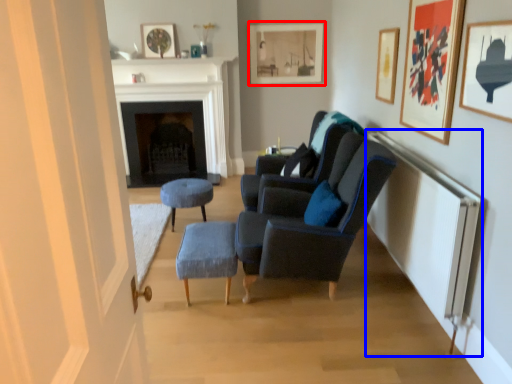
Question: Which object is further to the camera taking this photo, picture frame (highlighted by a red box) or radiator (highlighted by a blue box)?

Choices:
 (A) picture frame
 (B) radiator

Answer: (A)